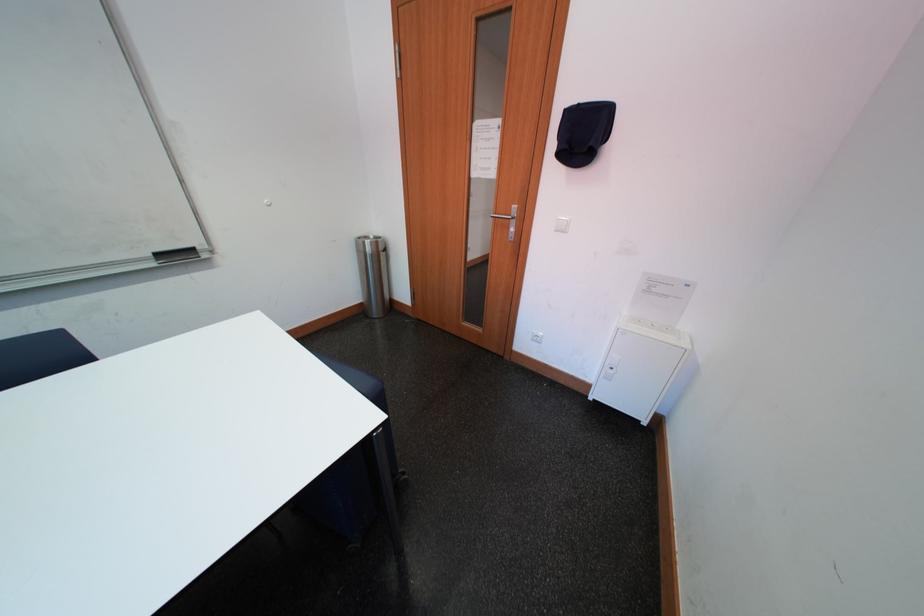
This screenshot has width=924, height=616. I want to click on metal door handle, so click(x=507, y=219).